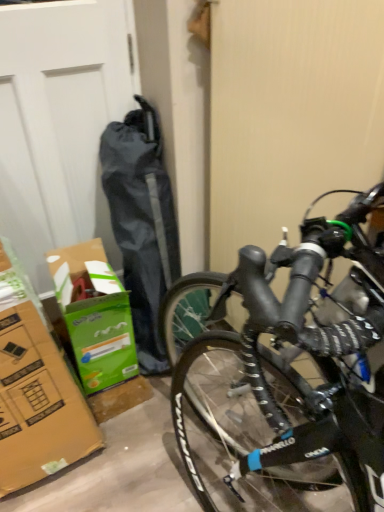
Question: Is green cardboard box at lower left to the left of white matte garage door at left from the viewer's perspective?

Choices:
 (A) no
 (B) yes

Answer: (A)

Question: Is green cardboard box at lower left positioned far away from white matte garage door at left?

Choices:
 (A) yes
 (B) no

Answer: (B)

Question: Is green cardboard box at lower left to the right of white matte garage door at left from the viewer's perspective?

Choices:
 (A) yes
 (B) no

Answer: (A)

Question: Is green cardboard box at lower left outside of white matte garage door at left?

Choices:
 (A) no
 (B) yes

Answer: (B)

Question: From a real-world perspective, is green cardboard box at lower left beneath white matte garage door at left?

Choices:
 (A) yes
 (B) no

Answer: (A)

Question: Can you confirm if green cardboard box at lower left is thinner than white matte garage door at left?

Choices:
 (A) yes
 (B) no

Answer: (B)

Question: Can you confirm if white matte garage door at left is positioned to the left of black matte bicycle at right?

Choices:
 (A) yes
 (B) no

Answer: (A)

Question: Is white matte garage door at left positioned before black matte bicycle at right?

Choices:
 (A) no
 (B) yes

Answer: (A)

Question: Is white matte garage door at left beside black matte bicycle at right?

Choices:
 (A) no
 (B) yes

Answer: (A)

Question: Is white matte garage door at left at the right side of black matte bicycle at right?

Choices:
 (A) no
 (B) yes

Answer: (A)

Question: Can you confirm if white matte garage door at left is shorter than black matte bicycle at right?

Choices:
 (A) yes
 (B) no

Answer: (A)

Question: Is white matte garage door at left taller than black matte bicycle at right?

Choices:
 (A) yes
 (B) no

Answer: (B)

Question: From a real-world perspective, is black matte bicycle at right located beneath white matte garage door at left?

Choices:
 (A) no
 (B) yes

Answer: (A)